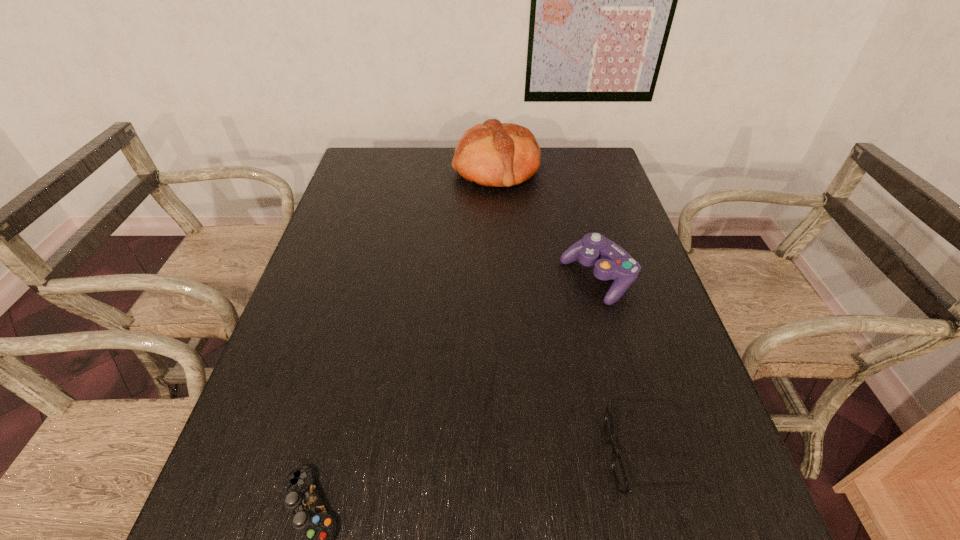
Find the location of a particular element. The image size is (960, 540). blank region between the farther control and the farthest object is located at coordinates (547, 224).

Locate which object is the closest to the right control. Please provide its 2D coordinates. Your answer should be formatted as a tuple, i.e. [(x, y)], where the tuple contains the x and y coordinates of a point satisfying the conditions above.

[(620, 476)]

Where is `object that stands as the second closest to the nearer control`? This screenshot has height=540, width=960. object that stands as the second closest to the nearer control is located at coordinates (611, 262).